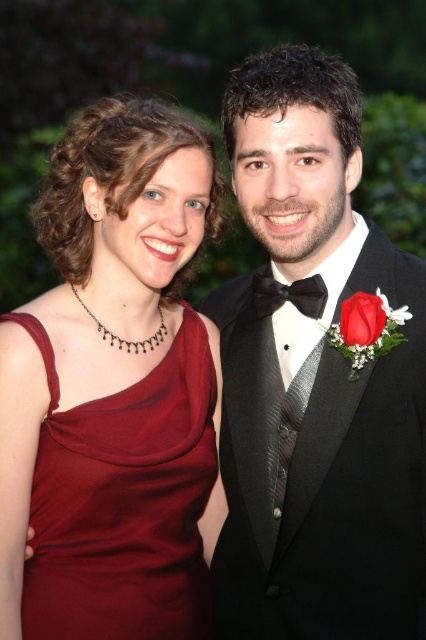
Does red velvet rose at center have a greater width compared to black satin bow tie at center?

No.

Does red velvet rose at center have a lesser height compared to black satin bow tie at center?

Incorrect, red velvet rose at center's height does not fall short of black satin bow tie at center's.

Where is `red velvet rose at center`? red velvet rose at center is located at coordinates (362, 323).

Is point (307, 371) positioned in front of point (48, 356)?

No, (307, 371) is further to viewer.

From the picture: Is black satin tuxedo at right closer to the viewer compared to burgundy satin dress at left?

No.

Between point (287, 554) and point (37, 492), which one is positioned in front?

Positioned in front is point (37, 492).

You are a GUI agent. You are given a task and a screenshot of the screen. Output one action in this format:
    pyautogui.click(x=<x>, y=<y>)
    Task: Click on the black satin tuxedo at right
    
    Given the screenshot: What is the action you would take?
    pyautogui.click(x=316, y=380)

Between black satin tuxedo at right and red velvet rose at center, which one is positioned higher?

red velvet rose at center is above.

Is black satin tuxedo at right taller than red velvet rose at center?

Correct, black satin tuxedo at right is much taller as red velvet rose at center.

Is point (359, 154) less distant than point (351, 339)?

No.

Locate an element on the screen. This screenshot has height=640, width=426. black satin tuxedo at right is located at coordinates (316, 380).